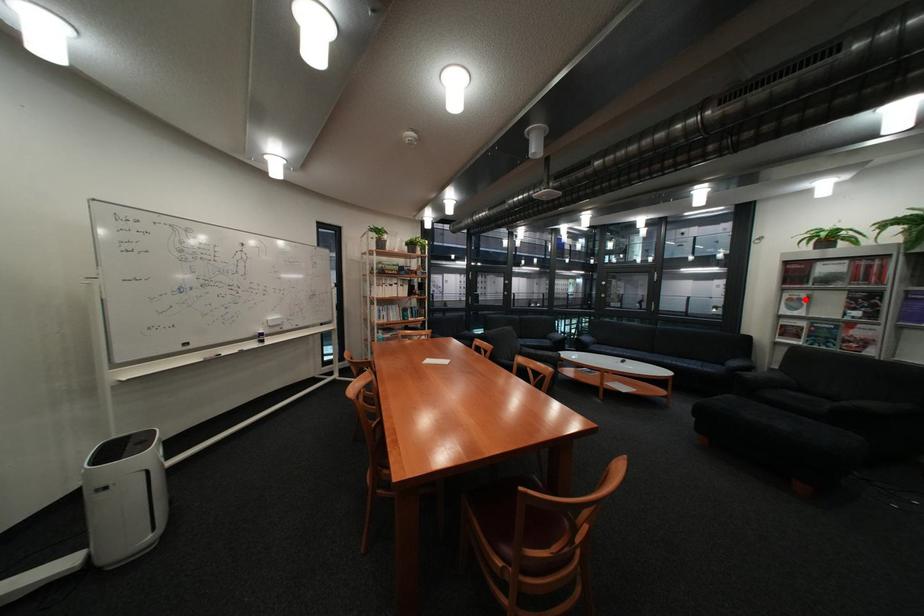
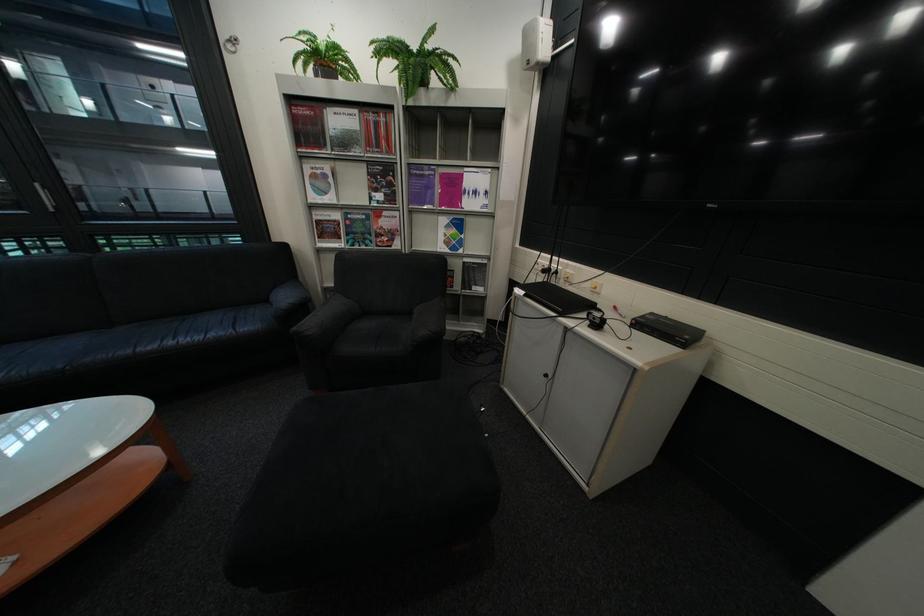
Question: I am providing you with two images of the same scene from different viewpoints. A red point is marked on the first image. Can you still see the location of the red point in image 2?

Choices:
 (A) Yes
 (B) No

Answer: (A)